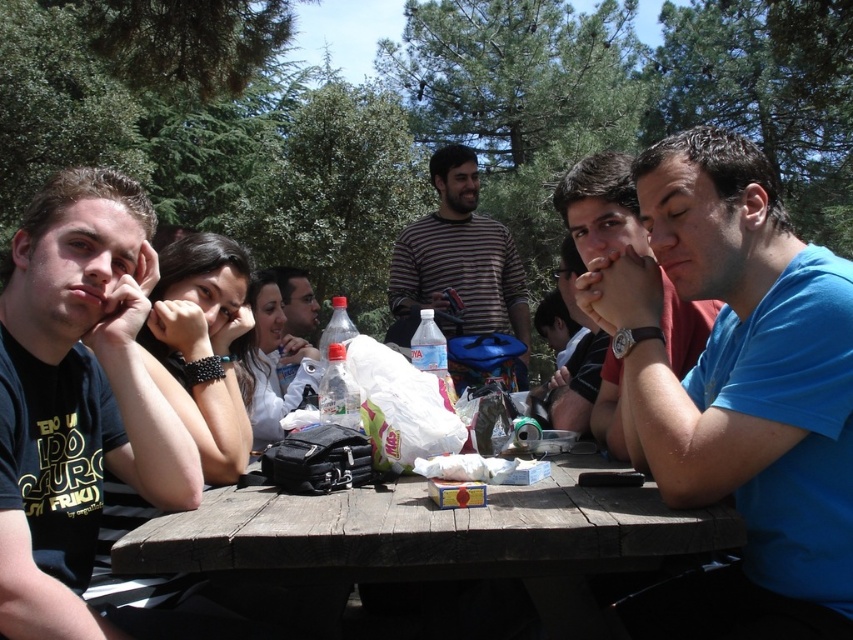
Question: Which object is positioned farthest from the blue fabric shirt at center?

Choices:
 (A) blue cotton shirt at center
 (B) matte black jacket at center
 (C) matte blue shirt at right
 (D) wooden picnic table at center

Answer: (B)

Question: Considering the relative positions of blue cotton shirt at center and striped cotton shirt at center in the image provided, where is blue cotton shirt at center located with respect to striped cotton shirt at center?

Choices:
 (A) right
 (B) left

Answer: (A)

Question: Which object is the closest to the wooden picnic table at center?

Choices:
 (A) black matte t-shirt at left
 (B) striped cotton shirt at center
 (C) matte blue shirt at right

Answer: (A)

Question: Is black matte t-shirt at left above striped cotton shirt at center?

Choices:
 (A) yes
 (B) no

Answer: (B)

Question: Which point is farther from the camera taking this photo?

Choices:
 (A) (141, 406)
 (B) (415, 284)

Answer: (B)

Question: Does striped cotton shirt at center have a smaller size compared to blue fabric shirt at center?

Choices:
 (A) no
 (B) yes

Answer: (A)